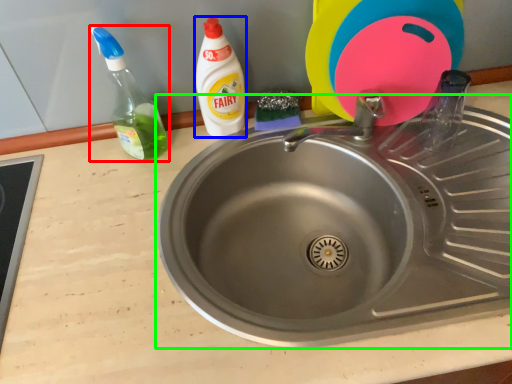
Question: Which is nearer to the bottle (highlighted by a red box)? cleaning product (highlighted by a blue box) or sink (highlighted by a green box).

Choices:
 (A) cleaning product
 (B) sink

Answer: (A)